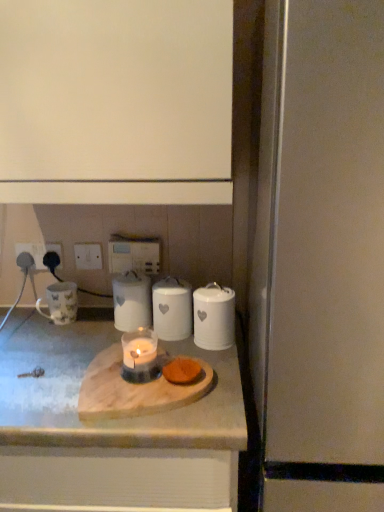
Question: Looking at their shapes, would you say white matte cabinet at upper center is wider or thinner than white marble countertop at center?

Choices:
 (A) wide
 (B) thin

Answer: (B)

Question: Is white matte cabinet at upper center taller or shorter than white marble countertop at center?

Choices:
 (A) short
 (B) tall

Answer: (A)

Question: Based on their relative distances, which object is nearer to the white ceramic jar at right, the fourth appliance in the left-to-right sequence?

Choices:
 (A) satin silver fridge at right, placed as the fifth appliance when sorted from left to right
 (B) orange sponge at center
 (C) white ceramic jar at center, which is the 3th appliance in left-to-right order
 (D) white plastic electric outlet at lower left, positioned as the 2th electric outlet in left-to-right order
 (E) translucent glass candle at center

Answer: (C)

Question: Which object is positioned farthest from the satin silver fridge at right, the 1th appliance positioned from the right?

Choices:
 (A) white ceramic jar at right, the fourth appliance in the left-to-right sequence
 (B) white marble countertop at center
 (C) white matte cabinet at upper center
 (D) white plastic switch at upper center, the 1th electric outlet viewed from the right
 (E) white plastic electric outlet at lower left, positioned as the 2th electric outlet in left-to-right order

Answer: (E)